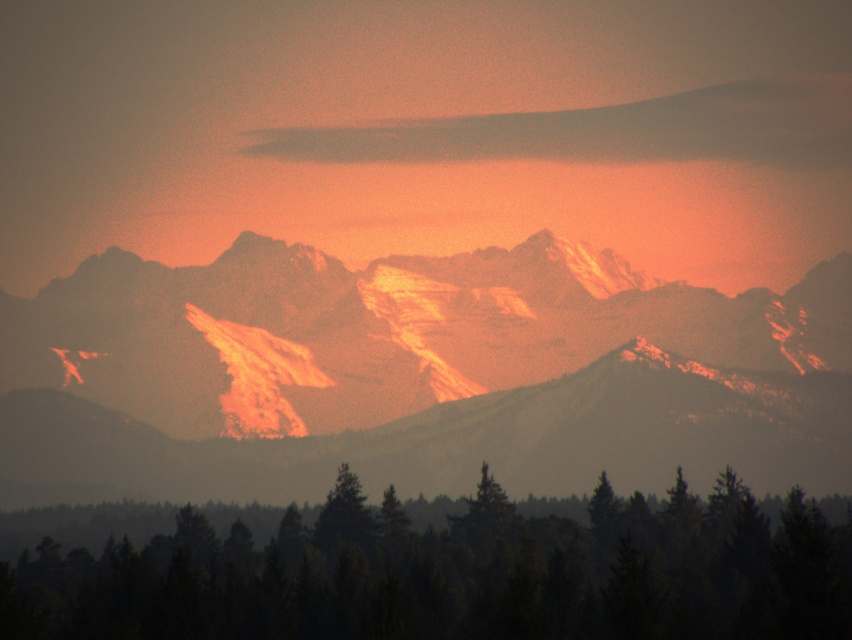
Question: Considering the real-world distances, which object is farthest from the green matte pine forest at lower center?

Choices:
 (A) green matte tree at center
 (B) smokey gray cloud at upper center

Answer: (B)

Question: Does sandy brown snow at center have a larger size compared to green matte tree at center?

Choices:
 (A) yes
 (B) no

Answer: (A)

Question: Which point appears farthest from the camera in this image?

Choices:
 (A) (783, 88)
 (B) (104, 572)
 (C) (49, 436)

Answer: (A)

Question: Where is sandy brown snow at center located in relation to green matte pine forest at lower center in the image?

Choices:
 (A) below
 (B) above

Answer: (B)

Question: Which point is closer to the camera?

Choices:
 (A) (222, 580)
 (B) (396, 147)

Answer: (B)

Question: From the image, what is the correct spatial relationship of green matte pine forest at lower center in relation to smokey gray cloud at upper center?

Choices:
 (A) below
 (B) above

Answer: (A)